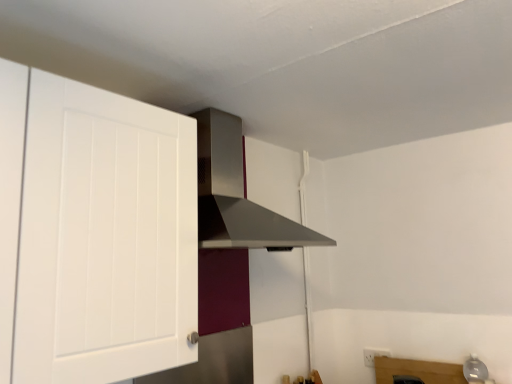
Question: Can you see white matte cabinet at left touching satin silver vent at upper center?

Choices:
 (A) yes
 (B) no

Answer: (B)

Question: From the image's perspective, is white matte cabinet at left on satin silver vent at upper center?

Choices:
 (A) yes
 (B) no

Answer: (B)

Question: Is white matte cabinet at left thinner than satin silver vent at upper center?

Choices:
 (A) no
 (B) yes

Answer: (B)

Question: Is white matte cabinet at left oriented away from satin silver vent at upper center?

Choices:
 (A) yes
 (B) no

Answer: (B)

Question: Is satin silver vent at upper center inside white matte cabinet at left?

Choices:
 (A) yes
 (B) no

Answer: (B)

Question: Does white matte cabinet at left have a lesser height compared to satin silver vent at upper center?

Choices:
 (A) yes
 (B) no

Answer: (B)

Question: From the image's perspective, is satin silver vent at upper center below white matte cabinet at left?

Choices:
 (A) no
 (B) yes

Answer: (A)

Question: Considering the relative sizes of satin silver vent at upper center and white matte cabinet at left in the image provided, is satin silver vent at upper center bigger than white matte cabinet at left?

Choices:
 (A) no
 (B) yes

Answer: (B)

Question: Does satin silver vent at upper center have a greater height compared to white matte cabinet at left?

Choices:
 (A) no
 (B) yes

Answer: (A)

Question: Is satin silver vent at upper center at the right side of white matte cabinet at left?

Choices:
 (A) yes
 (B) no

Answer: (A)

Question: Is the position of satin silver vent at upper center more distant than that of white matte cabinet at left?

Choices:
 (A) yes
 (B) no

Answer: (A)

Question: Is satin silver vent at upper center placed right next to white matte cabinet at left?

Choices:
 (A) yes
 (B) no

Answer: (B)

Question: Is white matte cabinet at left taller or shorter than satin silver vent at upper center?

Choices:
 (A) tall
 (B) short

Answer: (A)